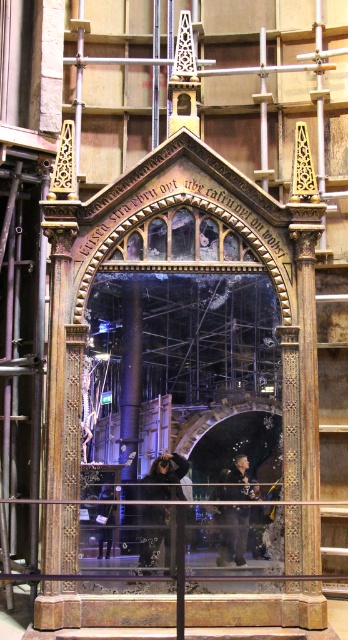
Question: Does black fabric construction worker at center have a larger size compared to black leather jacket at lower center?

Choices:
 (A) yes
 (B) no

Answer: (B)

Question: Does black fabric construction worker at center have a greater width compared to black leather jacket at lower center?

Choices:
 (A) no
 (B) yes

Answer: (A)

Question: Does black fabric construction worker at center appear under black leather jacket at lower center?

Choices:
 (A) yes
 (B) no

Answer: (B)

Question: Which object appears farthest from the camera in this image?

Choices:
 (A) black leather jacket at lower center
 (B) black fabric construction worker at center

Answer: (A)